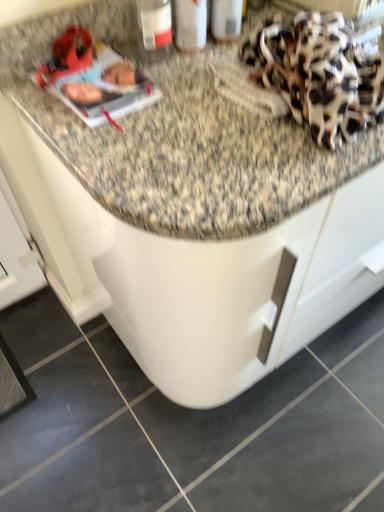
Question: Is matte plastic magazine at upper left aimed at matte plastic bottle at upper center?

Choices:
 (A) yes
 (B) no

Answer: (B)

Question: From the image's perspective, is matte plastic magazine at upper left beneath matte plastic bottle at upper center?

Choices:
 (A) no
 (B) yes

Answer: (B)

Question: Is matte plastic magazine at upper left turned away from matte plastic bottle at upper center?

Choices:
 (A) yes
 (B) no

Answer: (B)

Question: Is matte plastic magazine at upper left bigger than matte plastic bottle at upper center?

Choices:
 (A) no
 (B) yes

Answer: (A)

Question: Considering the relative sizes of matte plastic magazine at upper left and matte plastic bottle at upper center in the image provided, is matte plastic magazine at upper left smaller than matte plastic bottle at upper center?

Choices:
 (A) no
 (B) yes

Answer: (B)

Question: From a real-world perspective, is leopard print fabric at upper right physically located above or below matte plastic magazine at upper left?

Choices:
 (A) above
 (B) below

Answer: (A)

Question: Considering the positions of leopard print fabric at upper right and matte plastic magazine at upper left in the image, is leopard print fabric at upper right wider or thinner than matte plastic magazine at upper left?

Choices:
 (A) wide
 (B) thin

Answer: (A)

Question: Based on their positions, is leopard print fabric at upper right located to the left or right of matte plastic magazine at upper left?

Choices:
 (A) right
 (B) left

Answer: (A)

Question: Considering the positions of leopard print fabric at upper right and matte plastic magazine at upper left in the image, is leopard print fabric at upper right taller or shorter than matte plastic magazine at upper left?

Choices:
 (A) tall
 (B) short

Answer: (A)

Question: From a real-world perspective, relative to leopard print fabric at upper right, is matte plastic magazine at upper left vertically above or below?

Choices:
 (A) below
 (B) above

Answer: (A)

Question: In terms of size, does matte plastic magazine at upper left appear bigger or smaller than leopard print fabric at upper right?

Choices:
 (A) big
 (B) small

Answer: (B)

Question: From the image's perspective, is matte plastic magazine at upper left located above or below leopard print fabric at upper right?

Choices:
 (A) below
 (B) above

Answer: (A)

Question: Would you say matte plastic magazine at upper left is inside or outside leopard print fabric at upper right?

Choices:
 (A) inside
 (B) outside

Answer: (B)

Question: Is matte plastic magazine at upper left in front of or behind matte plastic bottle at upper center in the image?

Choices:
 (A) behind
 (B) front

Answer: (B)

Question: From the image's perspective, relative to matte plastic bottle at upper center, is matte plastic magazine at upper left above or below?

Choices:
 (A) above
 (B) below

Answer: (B)